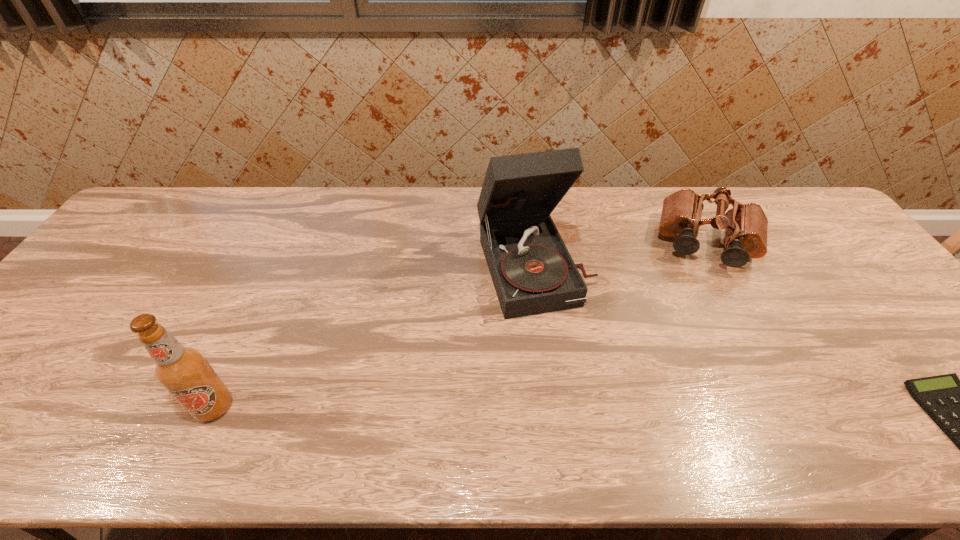
Locate an element on the screen. vacant space on the desktop that is between the beer bottle and the rightmost object and is positioned on the front-facing side of the second object from left to right is located at coordinates (593, 410).

Image resolution: width=960 pixels, height=540 pixels. Identify the location of vacant space on the desktop that is between the second tallest object and the shortest object and is positioned through the eyepieces of the binoculars. (689, 411).